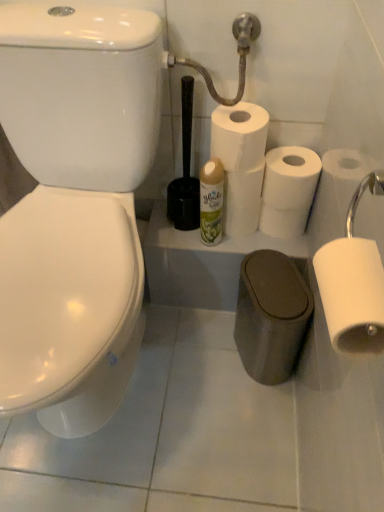
In order to click on free space in front of black plastic toilet brush at center in this screenshot , I will do `click(183, 242)`.